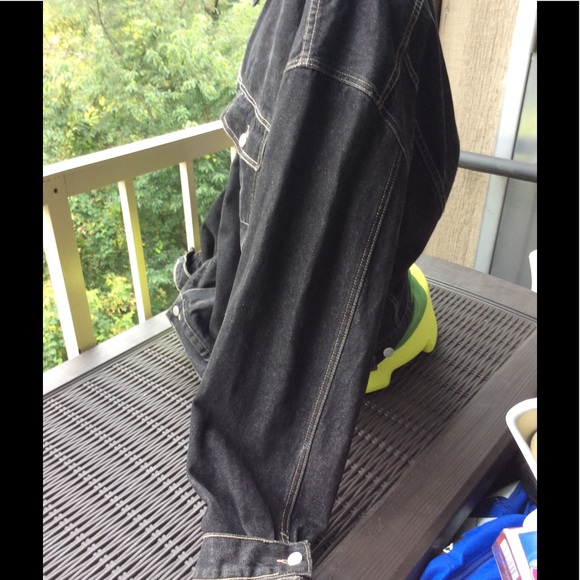
Locate an element on the screen. Image resolution: width=580 pixels, height=580 pixels. stand is located at coordinates (72, 307).